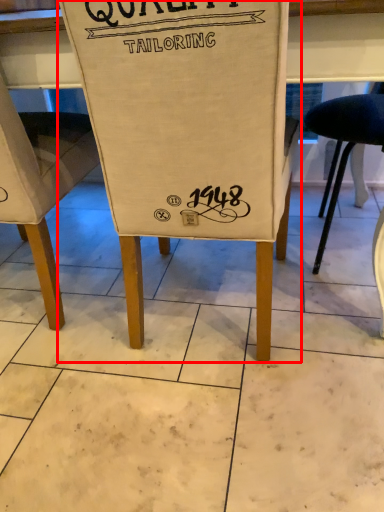
Question: From the image's perspective, what is the correct spatial relationship of chair (annotated by the red box) in relation to chair?

Choices:
 (A) above
 (B) below

Answer: (B)